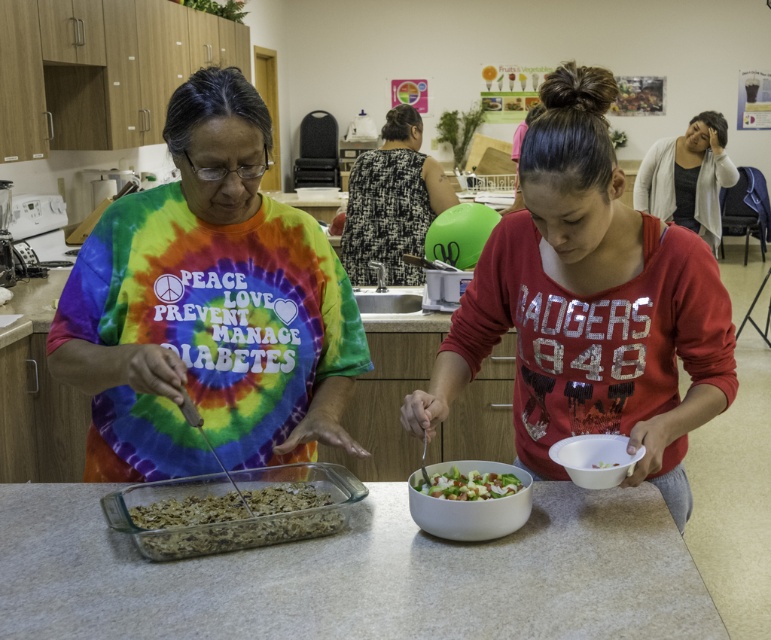
Question: Considering the real-world distances, which object is farthest from the white plastic bowl at lower right?

Choices:
 (A) brown crumbly mixture at center
 (B) white matte bowl at center

Answer: (A)

Question: Which object is positioned closest to the white laminate counter at center?

Choices:
 (A) matte red shirt at center
 (B) white glossy bowl at center

Answer: (B)

Question: Is black textured dress at center above brown crumbly mixture at center?

Choices:
 (A) yes
 (B) no

Answer: (A)

Question: Is white laminate counter at center below black textured dress at center?

Choices:
 (A) yes
 (B) no

Answer: (A)

Question: Can you confirm if white laminate counter at center is thinner than white glossy bowl at center?

Choices:
 (A) no
 (B) yes

Answer: (A)

Question: Estimate the real-world distances between objects in this image. Which object is closer to the white laminate counter at center?

Choices:
 (A) white plastic bowl at lower right
 (B) black textured dress at center

Answer: (A)